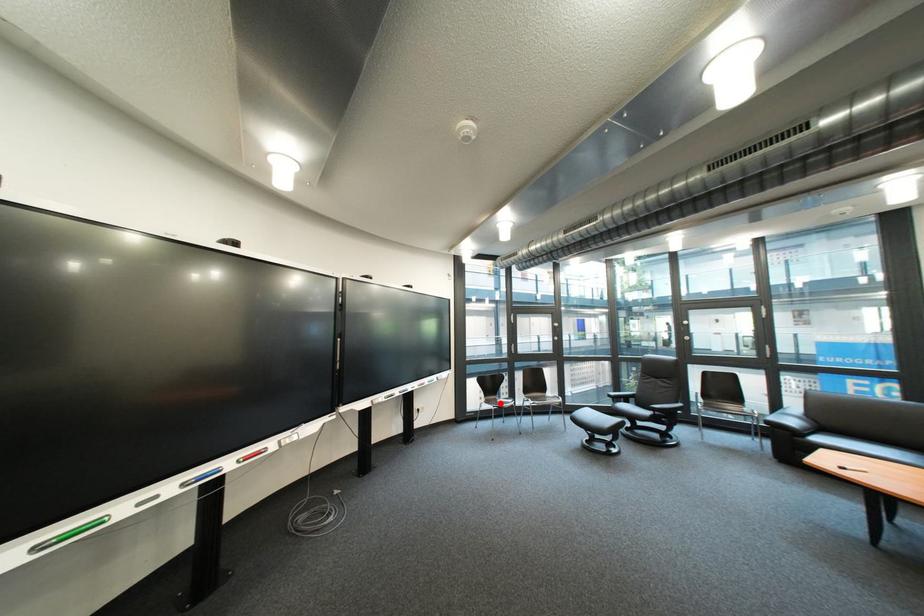
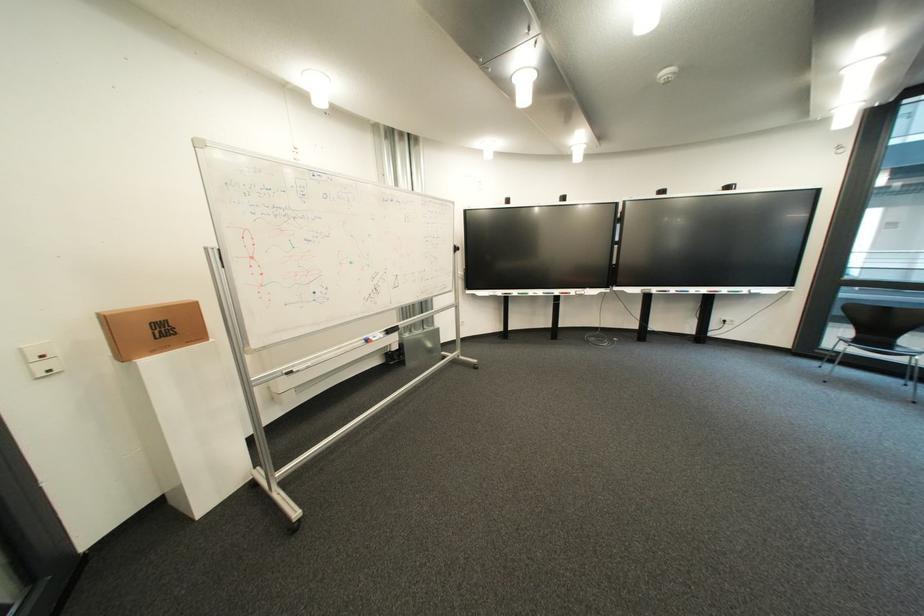
Question: I am providing you with two images of the same scene from different viewpoints. A red point is shown in image1. For the corresponding object point in image2, is it positioned nearer or farther from the camera?

Choices:
 (A) Nearer
 (B) Farther

Answer: (A)